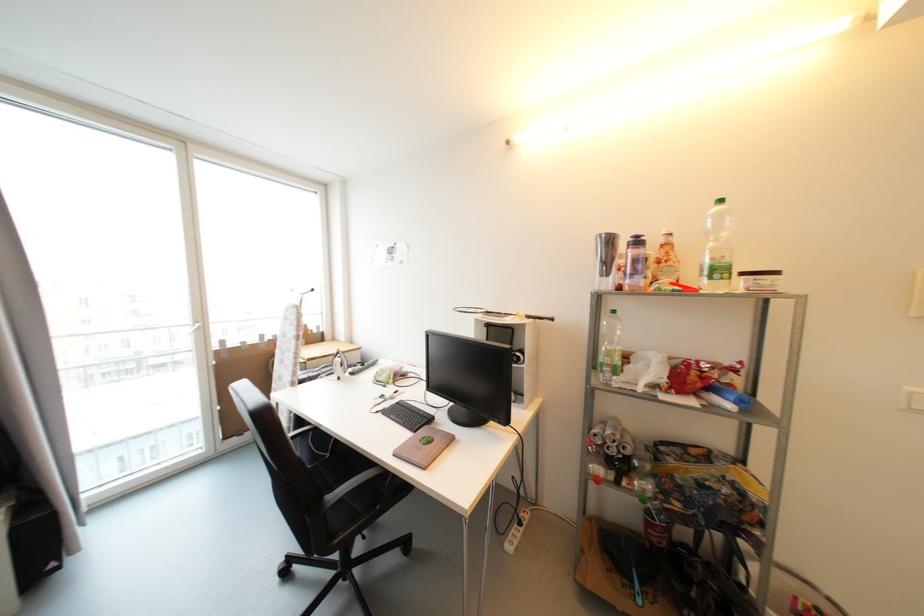
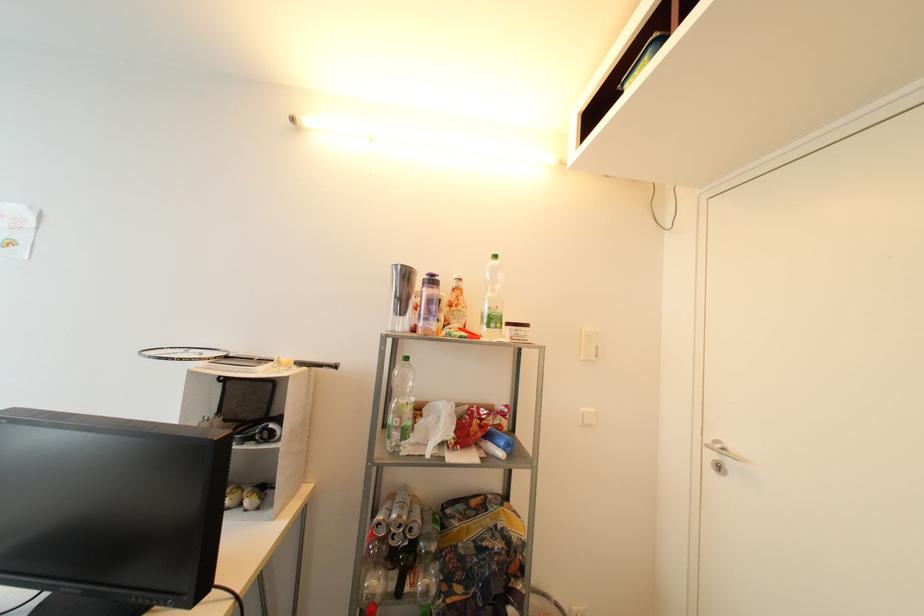
Locate, in the second image, the point that corresponds to point 723,273 in the first image.

(499, 322)